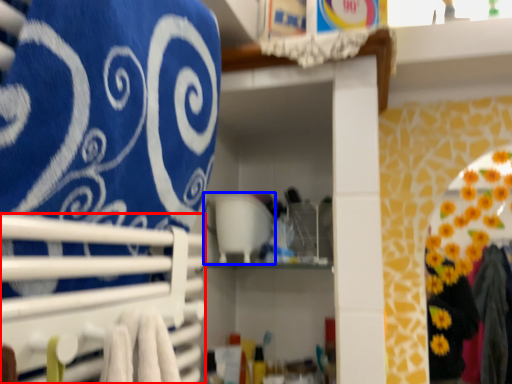
Question: Which object appears closest to the camera in this image, closet (highlighted by a red box) or appliance (highlighted by a blue box)?

Choices:
 (A) closet
 (B) appliance

Answer: (A)